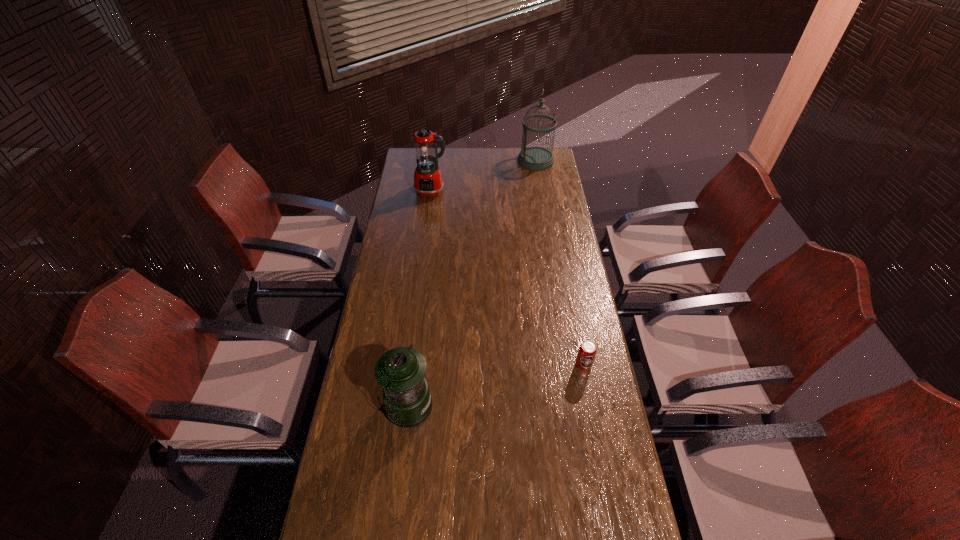
Locate an element on the screen. This screenshot has width=960, height=540. vacant space situated 0.390m on the front-facing side of the tallest object is located at coordinates (447, 160).

This screenshot has width=960, height=540. What are the coordinates of `free location located on the controls of the second farthest object` in the screenshot? It's located at (424, 240).

Find the location of a particular element. Image resolution: width=960 pixels, height=540 pixels. vacant space located on the back of the nearest object is located at coordinates (420, 308).

This screenshot has height=540, width=960. I want to click on vacant position located on the front of the shortest object, so click(594, 422).

Find the location of `object that is positioned at the far edge`. object that is positioned at the far edge is located at coordinates (534, 158).

This screenshot has width=960, height=540. I want to click on food processor positioned at the left edge, so click(428, 182).

This screenshot has width=960, height=540. I want to click on lantern that is at the left edge, so [x=401, y=371].

In order to click on birdcage that is at the right edge in this screenshot , I will do `click(534, 158)`.

I want to click on soda that is at the right edge, so click(x=587, y=350).

This screenshot has width=960, height=540. Identify the location of object at the far right corner. (534, 158).